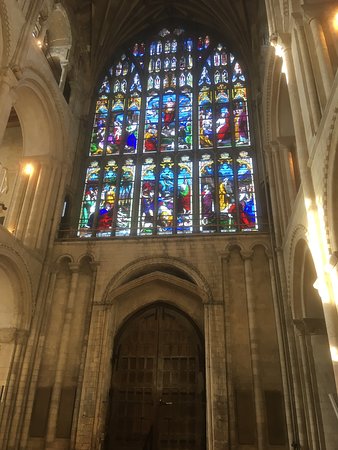
Locate an element on the screen. The image size is (338, 450). handle is located at coordinates (164, 399).